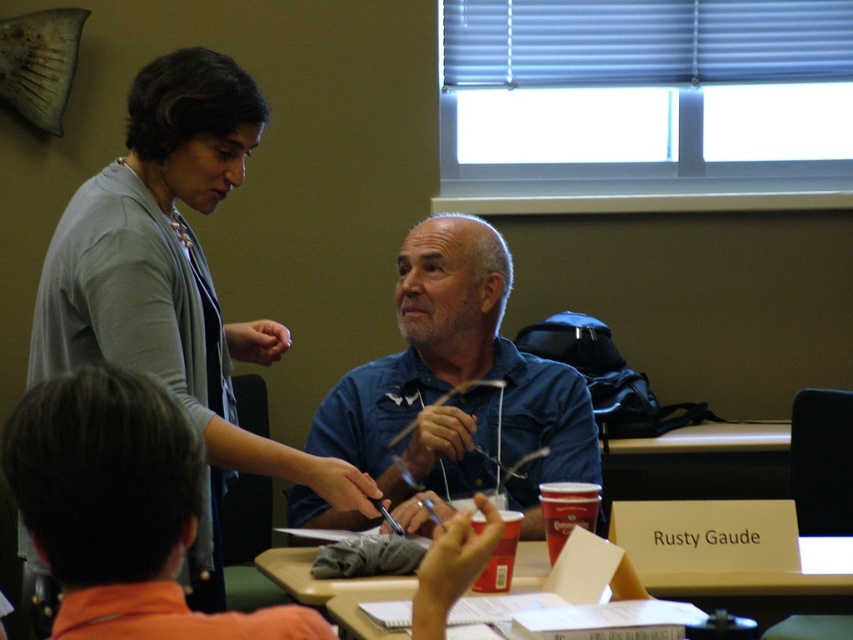
Question: Can you confirm if gray cardigan at upper left is positioned to the right of blue denim shirt at center?

Choices:
 (A) yes
 (B) no

Answer: (B)

Question: Can you confirm if blue denim shirt at center is thinner than wooden desk at center?

Choices:
 (A) yes
 (B) no

Answer: (A)

Question: Which point is farther to the camera?

Choices:
 (A) (732, 596)
 (B) (573, 472)

Answer: (A)

Question: Which point is farther from the camera taking this photo?

Choices:
 (A) (140, 248)
 (B) (486, 464)
 (C) (691, 600)

Answer: (B)

Question: Which object appears closest to the camera in this image?

Choices:
 (A) wooden desk at center
 (B) blue denim shirt at center

Answer: (A)

Question: In this image, where is blue denim shirt at center located relative to wooden desk at center?

Choices:
 (A) right
 (B) left

Answer: (B)